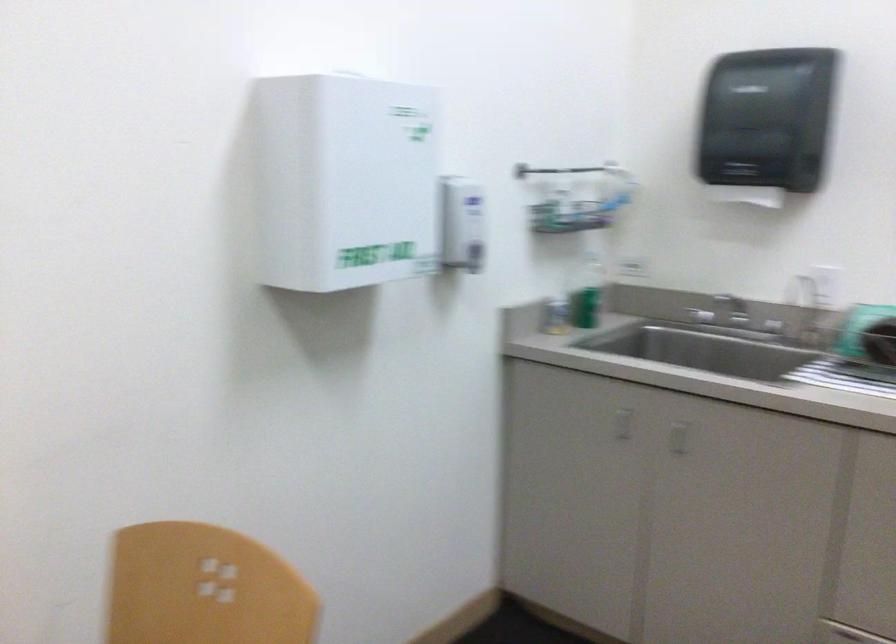
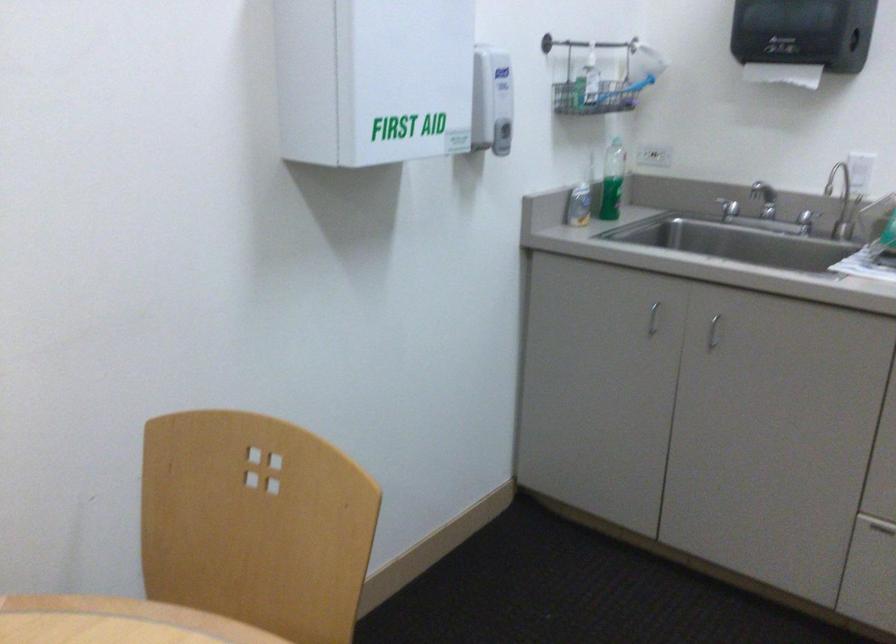
The point at [622,426] is marked in the first image. Where is the corresponding point in the second image?

(652, 319)